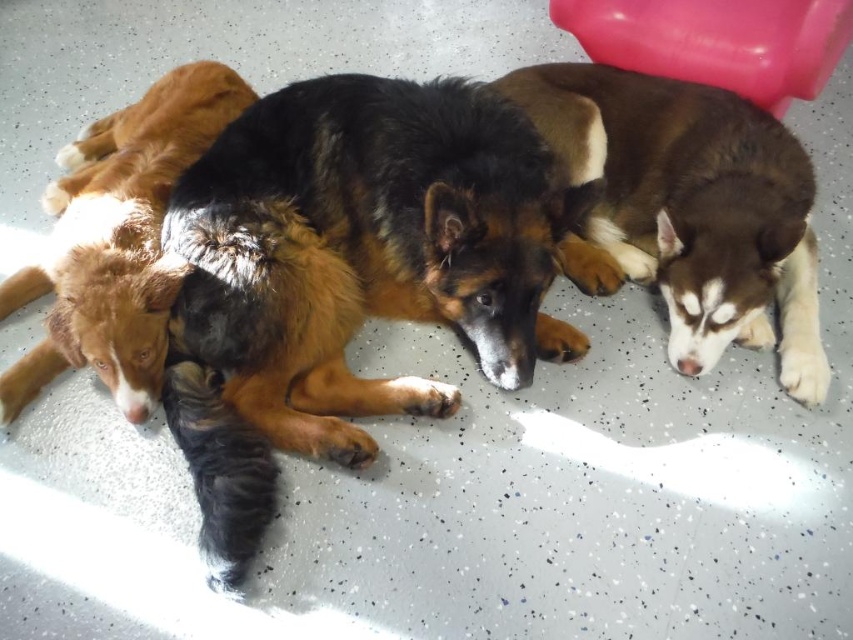
You are a photographer setting up a photo shoot for two dogs. You have the brown fur dog at right and the brown fluffy dog at center. You want to make sure the dogs are arranged in the correct order from left to right. Which dog should be placed to the left of the other?

The brown fur dog at right is positioned on the right side of the brown fluffy dog at center, so the brown fluffy dog at center should be placed to the left of the brown fur dog at right.

You are a photographer standing at a certain distance from the black fur dog at center. You want to take a photo of the dog but your camera has a minimum focus distance of 1.2 meters. Will you be able to focus on the dog without moving closer?

The distance between the black fur dog at center and the camera is 1.30 meters. Since the minimum focus distance is 1.2 meters, the camera can focus on the dog as the current distance is beyond the minimum requirement.